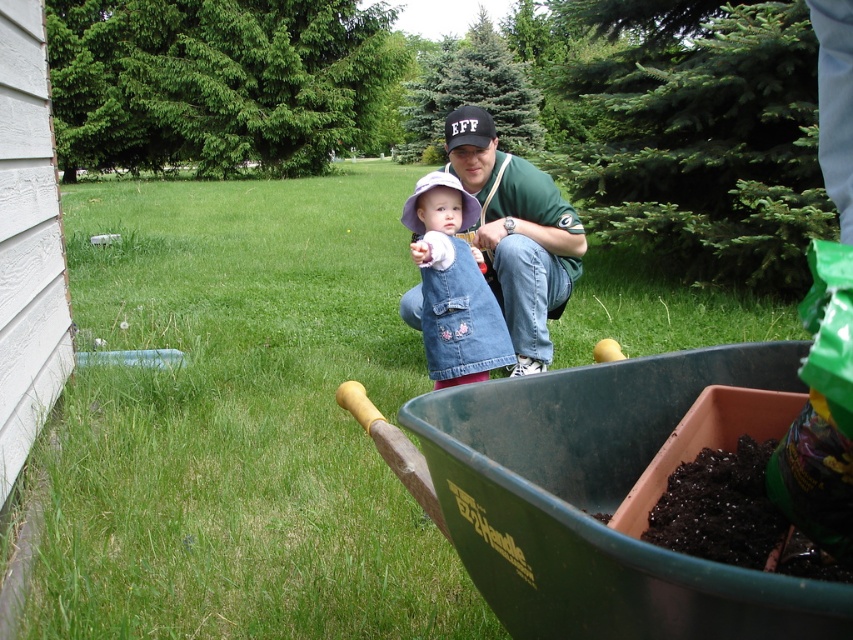
You are planning to place a new decorative stone path in the backyard. The path needs to be as wide as the widest object between the green grass at lower left and the denim vest at center. Which object should you use as a reference for the path width?

The green grass at lower left is wider than the denim vest at center, so you should use the green grass at lower left as the reference for the path width.

You are a gardener who needs to choose between the green jersey at center and the denim vest at center to wear while working. Which one would be more suitable for covering your upper body if you want something larger?

The green jersey at center is bigger than the denim vest at center, so it would be more suitable for covering your upper body if you want something larger.

You are a gardener who needs to decide where to place a new plant. You have two options in the image, the green grass at lower left and the denim vest at center. Which location has more space for the plant?

The green grass at lower left has more space for the plant since it is larger in size than the denim vest at center.